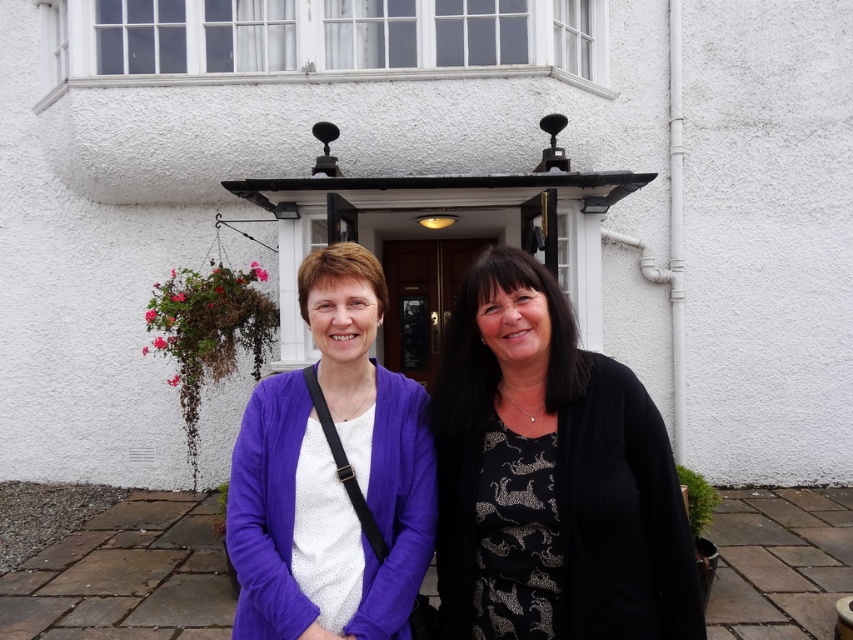
You are a photographer trying to capture a portrait of both the black textured dress at center and the purple fabric sweater at center. The camera has a depth of field that can focus on objects within 15 inches. Will both subjects be in focus?

The black textured dress at center is 15.82 inches away from the purple fabric sweater at center. Since the distance between them exceeds the camera sensor depth of field range of 15 inches, the photographer may need to adjust the focus or camera settings to ensure both are in focus.

You are a photographer setting up for a portrait. You notice two clothing items in the scene, the black textured dress at center and the purple fabric sweater at center. Which clothing item is positioned lower on the person?

The black textured dress at center is below the purple fabric sweater at center, so the black textured dress at center is positioned lower on the person.